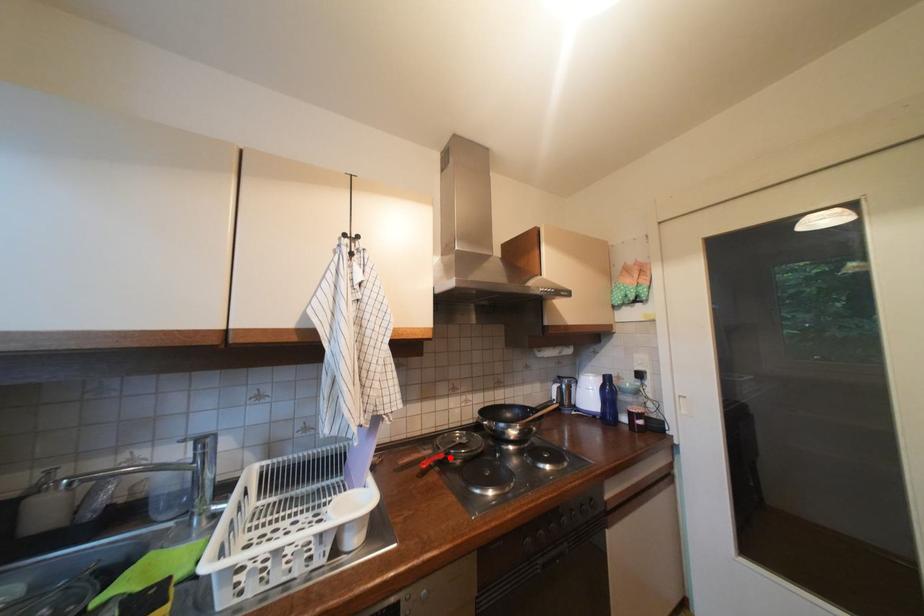
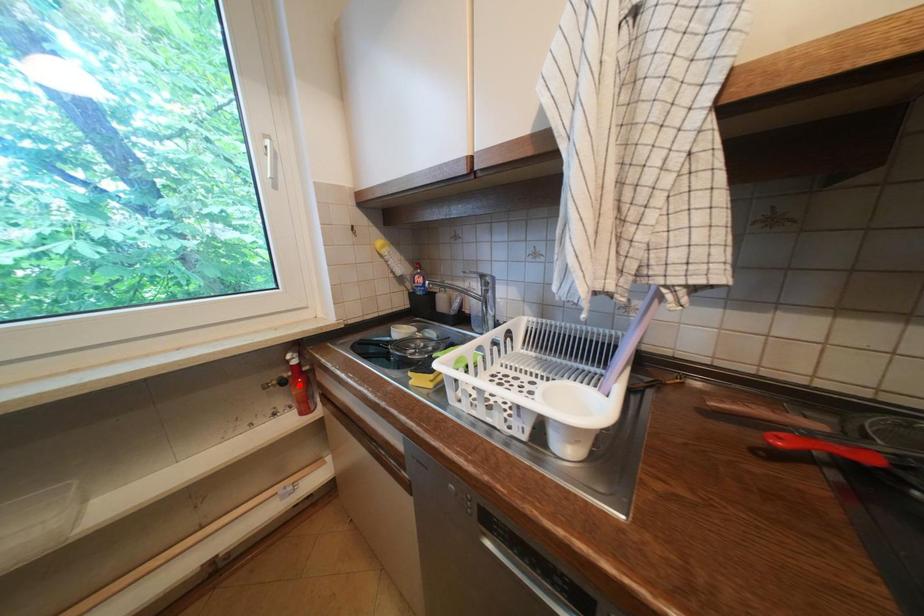
I am providing you with two images of the same scene from different viewpoints. A red point is marked on the first image and another point is marked on the second image. Are the points marked in image1 and image2 representing the same 3D position?

No